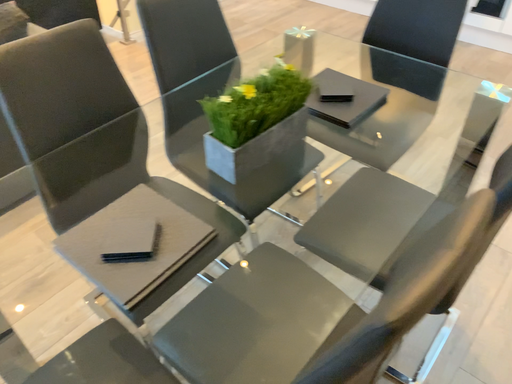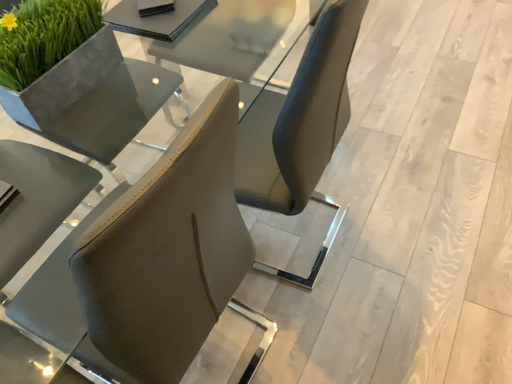
Question: Which way did the camera rotate in the video?

Choices:
 (A) rotated upward
 (B) rotated downward

Answer: (B)